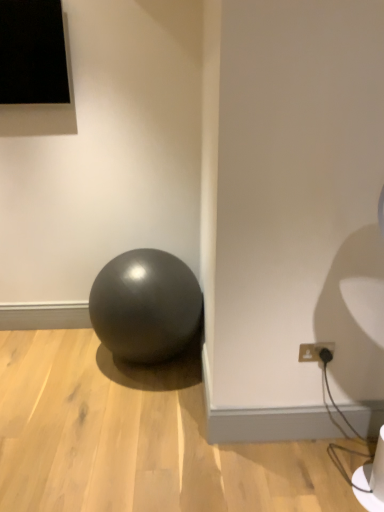
Image resolution: width=384 pixels, height=512 pixels. Describe the element at coordinates (145, 305) in the screenshot. I see `matte black ball at center` at that location.

At what (x,y) coordinates should I click in order to perform the action: click on matte black ball at center. Please return your answer as a coordinate pair (x, y). This screenshot has height=512, width=384. Looking at the image, I should click on (145, 305).

What is the approximate height of matte black outlet at lower right?

It is 3.93 inches.

Measure the distance between matte black outlet at lower right and camera.

The depth of matte black outlet at lower right is 5.94 feet.

Where is `matte black outlet at lower right`? The width and height of the screenshot is (384, 512). matte black outlet at lower right is located at coordinates (313, 350).

The width and height of the screenshot is (384, 512). What do you see at coordinates (313, 350) in the screenshot?
I see `matte black outlet at lower right` at bounding box center [313, 350].

At what (x,y) coordinates should I click in order to perform the action: click on matte black ball at center. Please return your answer as a coordinate pair (x, y). Looking at the image, I should click on (145, 305).

Considering the positions of objects matte black ball at center and matte black outlet at lower right in the image provided, who is more to the right, matte black ball at center or matte black outlet at lower right?

matte black outlet at lower right.

Does matte black ball at center come behind matte black outlet at lower right?

Yes, matte black ball at center is behind matte black outlet at lower right.

Considering the positions of points (117, 323) and (301, 349), is point (117, 323) farther from camera compared to point (301, 349)?

Yes, it is behind point (301, 349).

From the image's perspective, is matte black ball at center over matte black outlet at lower right?

Yes, from the image's perspective, matte black ball at center is on top of matte black outlet at lower right.

From a real-world perspective, does matte black ball at center sit lower than matte black outlet at lower right?

Indeed, from a real-world perspective, matte black ball at center is positioned beneath matte black outlet at lower right.

Looking at their sizes, would you say matte black ball at center is wider or thinner than matte black outlet at lower right?

Clearly, matte black ball at center has more width compared to matte black outlet at lower right.

Considering the relative sizes of matte black ball at center and matte black outlet at lower right in the image provided, is matte black ball at center taller than matte black outlet at lower right?

Yes, matte black ball at center is taller than matte black outlet at lower right.

Considering the sizes of objects matte black ball at center and matte black outlet at lower right in the image provided, who is bigger, matte black ball at center or matte black outlet at lower right?

matte black ball at center.

Do you think matte black ball at center is within matte black outlet at lower right, or outside of it?

matte black ball at center cannot be found inside matte black outlet at lower right.

Is there a large distance between matte black ball at center and matte black outlet at lower right?

That's not correct — matte black ball at center is a little close to matte black outlet at lower right.

Consider the image. Is matte black ball at center facing towards matte black outlet at lower right?

No, matte black ball at center is not aimed at matte black outlet at lower right.

Based on the photo, how many degrees apart are the facing directions of matte black ball at center and matte black outlet at lower right?

matte black ball at center and matte black outlet at lower right are facing 1.04 degrees away from each other.

Find the location of a particular element. The image size is (384, 512). ball behind the matte black outlet at lower right is located at coordinates pos(145,305).

Which object is positioned more to the left, matte black outlet at lower right or matte black ball at center?

Positioned to the left is matte black ball at center.

Is matte black outlet at lower right in front of or behind matte black ball at center in the image?

matte black outlet at lower right is positioned closer to the viewer than matte black ball at center.

Does point (309, 352) lie in front of point (102, 300)?

That is True.

From the image's perspective, which object appears higher, matte black outlet at lower right or matte black ball at center?

matte black ball at center appears higher in the image.

From a real-world perspective, which object rests below the other?

matte black ball at center is physically lower.

In terms of width, does matte black outlet at lower right look wider or thinner when compared to matte black ball at center?

Considering their sizes, matte black outlet at lower right looks slimmer than matte black ball at center.

Is matte black outlet at lower right taller than matte black ball at center?

Incorrect, the height of matte black outlet at lower right is not larger of that of matte black ball at center.

Can you confirm if matte black outlet at lower right is smaller than matte black ball at center?

Yes.

Would you say matte black outlet at lower right is outside matte black ball at center?

Indeed, matte black outlet at lower right is completely outside matte black ball at center.

Is matte black outlet at lower right positioned far away from matte black ball at center?

That's not correct — matte black outlet at lower right is a little close to matte black ball at center.

Is matte black outlet at lower right positioned with its back to matte black ball at center?

A: No.

How different are the orientations of matte black outlet at lower right and matte black ball at center in degrees?

The angle between the facing direction of matte black outlet at lower right and the facing direction of matte black ball at center is 1.04 degrees.

Measure the distance between matte black outlet at lower right and matte black ball at center.

A distance of 34.18 inches exists between matte black outlet at lower right and matte black ball at center.

The width and height of the screenshot is (384, 512). Find the location of `ball on the left of matte black outlet at lower right`. ball on the left of matte black outlet at lower right is located at coordinates (145, 305).

Where is `ball located above the matte black outlet at lower right (from the image's perspective)`? The height and width of the screenshot is (512, 384). ball located above the matte black outlet at lower right (from the image's perspective) is located at coordinates (145, 305).

Where is `ball that is under the matte black outlet at lower right (from a real-world perspective)`? This screenshot has width=384, height=512. ball that is under the matte black outlet at lower right (from a real-world perspective) is located at coordinates (145, 305).